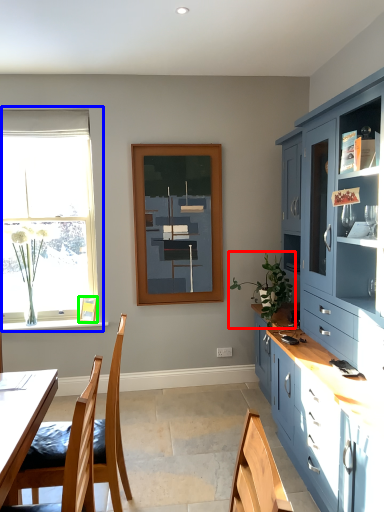
Question: Which object is the closest to the houseplant (highlighted by a red box)? Choose among these: window (highlighted by a blue box) or picture frame (highlighted by a green box).

Choices:
 (A) window
 (B) picture frame

Answer: (B)